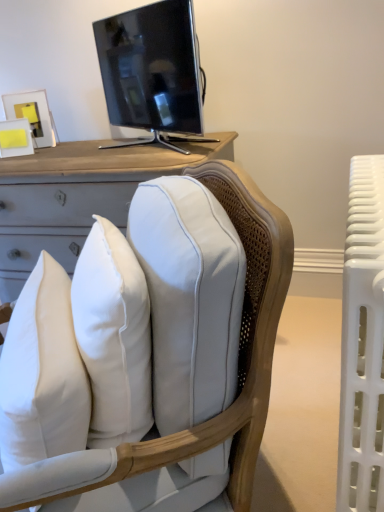
Question: Considering the positions of point (352, 257) and point (248, 297), is point (352, 257) closer or farther from the camera than point (248, 297)?

Choices:
 (A) farther
 (B) closer

Answer: (B)

Question: Looking at the image, does white plastic radiator at right seem bigger or smaller compared to white leather chair at center?

Choices:
 (A) small
 (B) big

Answer: (A)

Question: Estimate the real-world distances between objects in this image. Which object is closer to the white plastic radiator at right?

Choices:
 (A) white soft pillow at center
 (B) white leather chair at center
 (C) matte black tv at upper center

Answer: (B)

Question: Estimate the real-world distances between objects in this image. Which object is farther from the white leather chair at center?

Choices:
 (A) white plastic radiator at right
 (B) white soft pillow at center
 (C) matte black tv at upper center

Answer: (C)